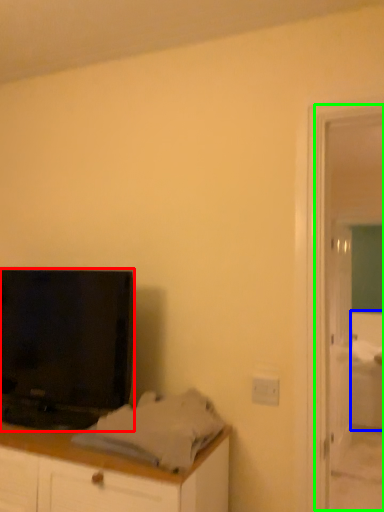
Question: Which is nearer to the television (highlighted by a red box)? bed (highlighted by a blue box) or screen door (highlighted by a green box).

Choices:
 (A) bed
 (B) screen door

Answer: (B)